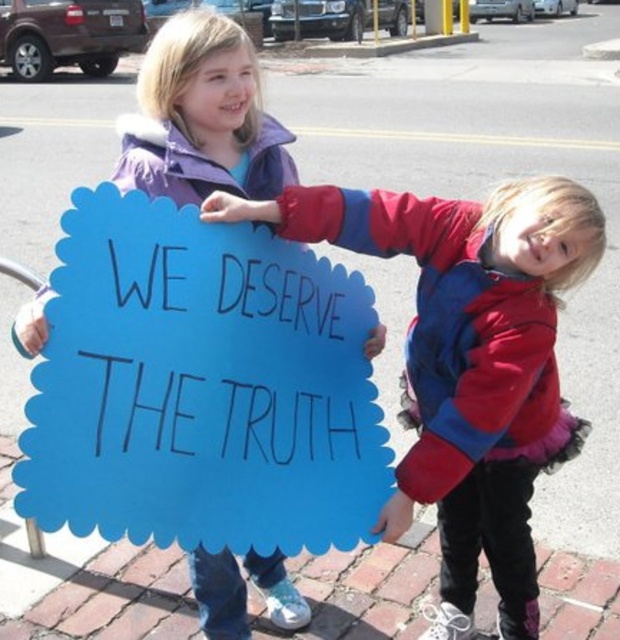
Who is higher up, blue paper sign at center or blue cardboard sign at center?

blue paper sign at center

Which of these two, blue paper sign at center or blue cardboard sign at center, stands taller?

Standing taller between the two is blue cardboard sign at center.

Is point (262, 330) behind point (467, 577)?

No.

Locate an element on the screen. Image resolution: width=620 pixels, height=640 pixels. blue paper sign at center is located at coordinates (202, 387).